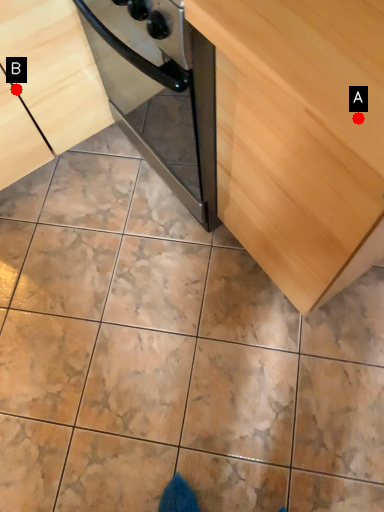
Question: Two points are circled on the image, labeled by A and B beside each circle. Which point is farther from the camera taking this photo?

Choices:
 (A) A is further
 (B) B is further

Answer: (B)